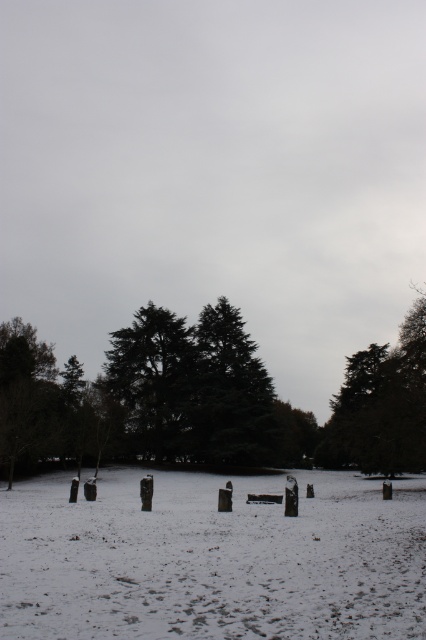
Between green matte tree at right and green textured tree at center, which one is positioned higher?

Positioned higher is green textured tree at center.

Is point (412, 436) behind point (163, 445)?

No.

Locate an element on the screen. The width and height of the screenshot is (426, 640). green matte tree at right is located at coordinates coord(380,404).